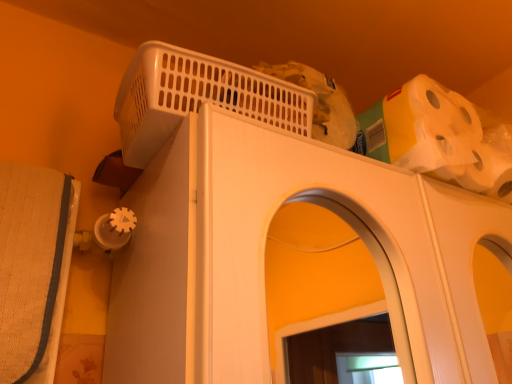
The width and height of the screenshot is (512, 384). What are the coordinates of `white plastic basket at upper center` in the screenshot? It's located at (197, 97).

You are a GUI agent. You are given a task and a screenshot of the screen. Output one action in this format:
    pyautogui.click(x=<x>, y=<y>)
    Task: Click on the white matte toilet paper at upper right
    Image resolution: width=512 pixels, height=384 pixels.
    Given the screenshot: What is the action you would take?
    pyautogui.click(x=440, y=137)

The width and height of the screenshot is (512, 384). What are the coordinates of `white plastic basket at upper center` in the screenshot? It's located at (197, 97).

From a real-world perspective, is white plastic basket at upper center over white plastic basket at upper center?

Yes, from a real-world perspective, white plastic basket at upper center is above white plastic basket at upper center.

Is white plastic basket at upper center in contact with white plastic basket at upper center?

No, white plastic basket at upper center is not with white plastic basket at upper center.

Who is bigger, white plastic basket at upper center or white plastic basket at upper center?

white plastic basket at upper center.

Which point is more forward, (136, 131) or (214, 182)?

The point (214, 182) is in front.

Which is more to the right, white plastic basket at upper center or white plastic basket at upper center?

white plastic basket at upper center.

Which object is closer to the camera taking this photo, white plastic basket at upper center or white plastic basket at upper center?

white plastic basket at upper center.

Is white plastic basket at upper center touching white plastic basket at upper center?

white plastic basket at upper center is not next to white plastic basket at upper center, and they're not touching.

Considering the sizes of white plastic basket at upper center and white plastic basket at upper center in the image, is white plastic basket at upper center bigger or smaller than white plastic basket at upper center?

Clearly, white plastic basket at upper center is larger in size than white plastic basket at upper center.

Can you tell me how much white plastic basket at upper center and white matte toilet paper at upper right differ in facing direction?

The angular difference between white plastic basket at upper center and white matte toilet paper at upper right is 3.57 degrees.

Which is behind, point (242, 265) or point (421, 163)?

The point (421, 163) is farther from the camera.

Is white plastic basket at upper center located outside white matte toilet paper at upper right?

Yes, white plastic basket at upper center is not within white matte toilet paper at upper right.

Where is `basket in front of the white matte toilet paper at upper right`? basket in front of the white matte toilet paper at upper right is located at coordinates pos(197,97).

Looking at this image, considering their positions, is white matte toilet paper at upper right located in front of or behind white plastic basket at upper center?

In the image, white matte toilet paper at upper right appears behind white plastic basket at upper center.

Is white matte toilet paper at upper right next to white plastic basket at upper center?

No, white matte toilet paper at upper right is not beside white plastic basket at upper center.

Can you confirm if white matte toilet paper at upper right is bigger than white plastic basket at upper center?

No, white matte toilet paper at upper right is not bigger than white plastic basket at upper center.

Which is more to the left, white matte toilet paper at upper right or white plastic basket at upper center?

white plastic basket at upper center.

Consider the image. Would you say white matte toilet paper at upper right is outside white plastic basket at upper center?

That's correct, white matte toilet paper at upper right is outside of white plastic basket at upper center.

Is white plastic basket at upper center smaller than white matte toilet paper at upper right?

Yes.

Which is more to the left, white plastic basket at upper center or white matte toilet paper at upper right?

white plastic basket at upper center.

Based on the photo, from the image's perspective, does white plastic basket at upper center appear higher than white matte toilet paper at upper right?

Yes, from the image's perspective, white plastic basket at upper center is above white matte toilet paper at upper right.

Considering the sizes of objects white plastic basket at upper center and white matte toilet paper at upper right in the image provided, who is taller, white plastic basket at upper center or white matte toilet paper at upper right?

white matte toilet paper at upper right.

Image resolution: width=512 pixels, height=384 pixels. What are the coordinates of `basket above the white plastic basket at upper center (from the image's perspective)` in the screenshot? It's located at (197, 97).

The image size is (512, 384). I want to click on home appliance that is on the right side of white plastic basket at upper center, so click(264, 256).

Based on their spatial positions, is white plastic basket at upper center or white plastic basket at upper center closer to white matte toilet paper at upper right?

white plastic basket at upper center lies closer to white matte toilet paper at upper right than the other object.

Estimate the real-world distances between objects in this image. Which object is closer to white plastic basket at upper center, white matte toilet paper at upper right or white plastic basket at upper center?

Based on the image, white plastic basket at upper center appears to be nearer to white plastic basket at upper center.

From the image, which object appears to be nearer to white plastic basket at upper center, white matte toilet paper at upper right or white plastic basket at upper center?

white plastic basket at upper center lies closer to white plastic basket at upper center than the other object.

When comparing their distances from white plastic basket at upper center, does white plastic basket at upper center or white matte toilet paper at upper right seem closer?

white plastic basket at upper center is positioned closer to the anchor white plastic basket at upper center.

When comparing their distances from white matte toilet paper at upper right, does white plastic basket at upper center or white plastic basket at upper center seem further?

The object further to white matte toilet paper at upper right is white plastic basket at upper center.

Looking at the image, which one is located closer to white plastic basket at upper center, white plastic basket at upper center or white matte toilet paper at upper right?

white plastic basket at upper center.

This screenshot has width=512, height=384. What are the coordinates of `home appliance between white plastic basket at upper center and white matte toilet paper at upper right from left to right` in the screenshot? It's located at (264, 256).